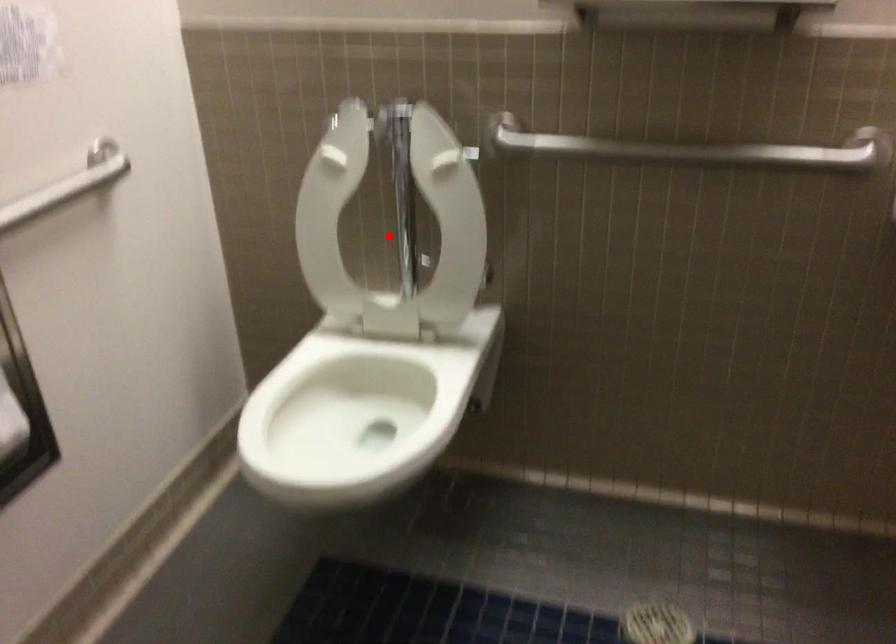
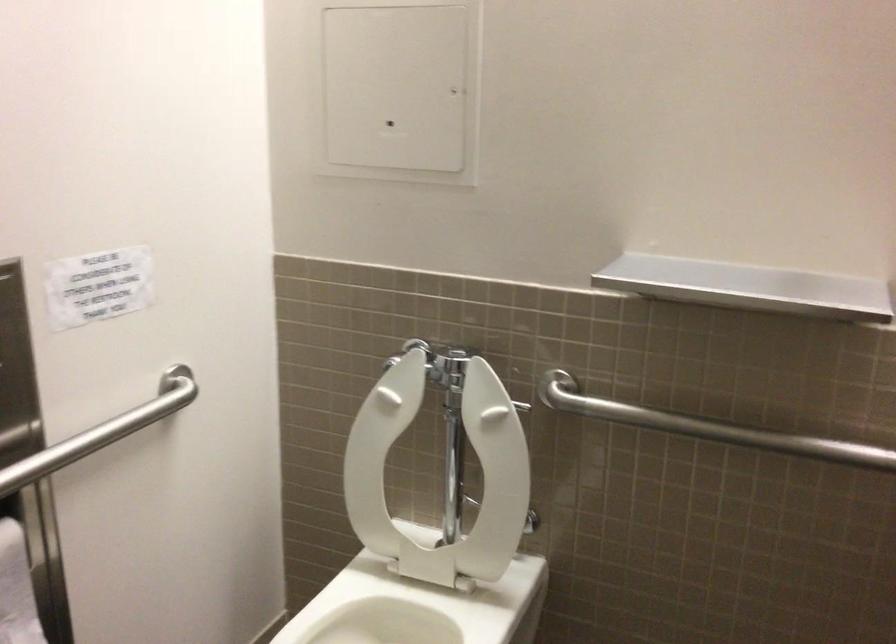
Find the pixel in the second image that matches the highlighted location in the first image.

(440, 474)